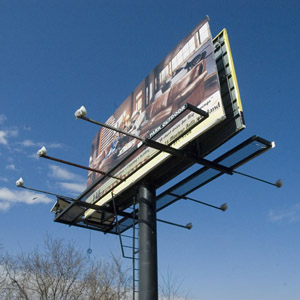
Locate an element on the screen. The width and height of the screenshot is (300, 300). lights is located at coordinates (62, 167).